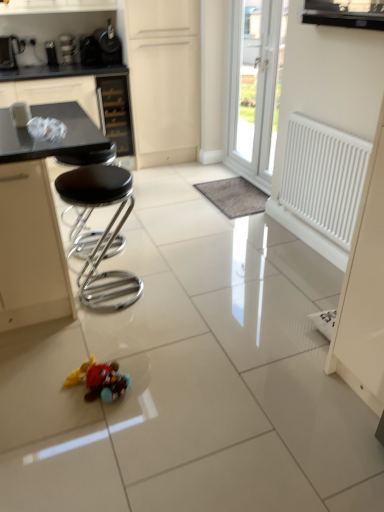
Question: Considering the relative sizes of black glass drawer at upper center and metallic black coffee maker at upper left, positioned as the first appliance in right-to-left order, in the image provided, is black glass drawer at upper center shorter than metallic black coffee maker at upper left, positioned as the first appliance in right-to-left order,?

Choices:
 (A) no
 (B) yes

Answer: (A)

Question: Is black glass drawer at upper center at the right side of metallic black coffee maker at upper left, positioned as the first appliance in right-to-left order?

Choices:
 (A) yes
 (B) no

Answer: (B)

Question: Does black glass drawer at upper center have a greater width compared to metallic black coffee maker at upper left, positioned as the first appliance in right-to-left order?

Choices:
 (A) yes
 (B) no

Answer: (A)

Question: Does black glass drawer at upper center appear on the left side of metallic black coffee maker at upper left, the third appliance viewed from the left?

Choices:
 (A) no
 (B) yes

Answer: (B)

Question: Is black glass drawer at upper center positioned before metallic black coffee maker at upper left, positioned as the first appliance in right-to-left order?

Choices:
 (A) yes
 (B) no

Answer: (B)

Question: From the image's perspective, does black glass drawer at upper center appear lower than metallic black coffee maker at upper left, positioned as the first appliance in right-to-left order?

Choices:
 (A) yes
 (B) no

Answer: (A)

Question: Is plush toy at center smaller than matte cream cabinet at upper center?

Choices:
 (A) yes
 (B) no

Answer: (A)

Question: Is plush toy at center not close to matte cream cabinet at upper center?

Choices:
 (A) yes
 (B) no

Answer: (A)

Question: Is plush toy at center oriented away from matte cream cabinet at upper center?

Choices:
 (A) no
 (B) yes

Answer: (A)

Question: From the image's perspective, is plush toy at center beneath matte cream cabinet at upper center?

Choices:
 (A) yes
 (B) no

Answer: (A)

Question: Is plush toy at center outside matte cream cabinet at upper center?

Choices:
 (A) no
 (B) yes

Answer: (B)

Question: From the image's perspective, is plush toy at center over matte cream cabinet at upper center?

Choices:
 (A) yes
 (B) no

Answer: (B)

Question: Is brushed metal toaster at upper left, which is the third appliance from right to left, outside white plastic door at upper center?

Choices:
 (A) no
 (B) yes

Answer: (B)